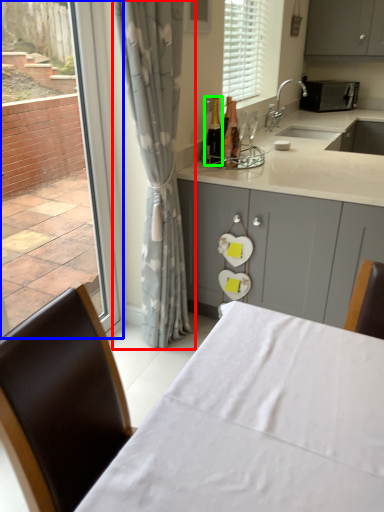
Question: Which object is the closest to the curtain (highlighted by a red box)? Choose among these: window (highlighted by a blue box) or bottle (highlighted by a green box).

Choices:
 (A) window
 (B) bottle

Answer: (A)